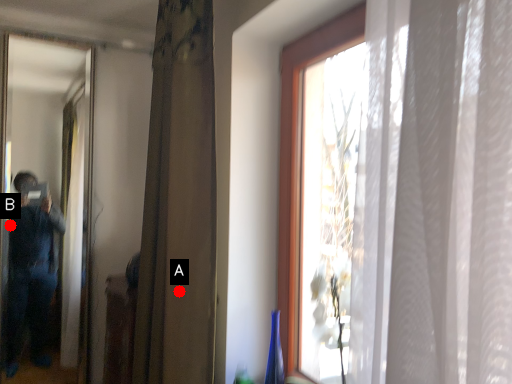
Question: Two points are circled on the image, labeled by A and B beside each circle. Which point is farther to the camera?

Choices:
 (A) A is further
 (B) B is further

Answer: (B)